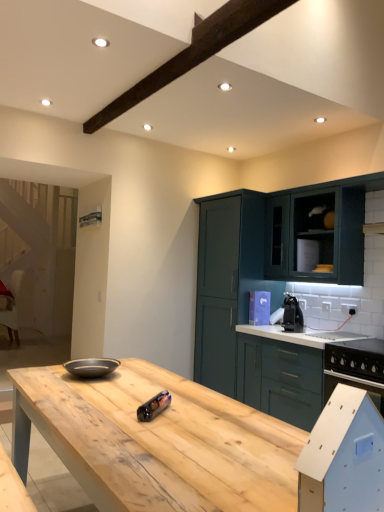
In order to click on vacant space in front of metallic cylindrical can at center, the 1th appliance in the front-to-back sequence in this screenshot , I will do `click(159, 429)`.